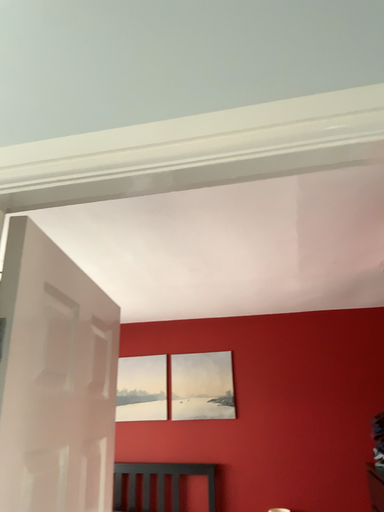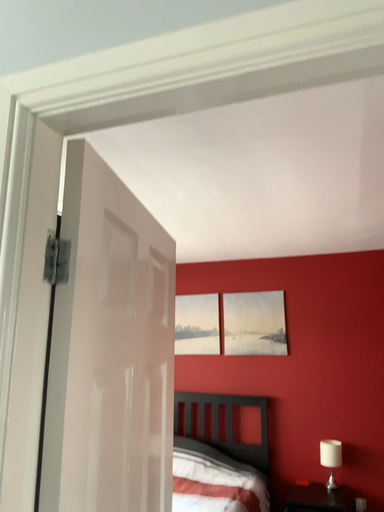
Question: How did the camera likely rotate when shooting the video?

Choices:
 (A) rotated right
 (B) rotated left

Answer: (B)